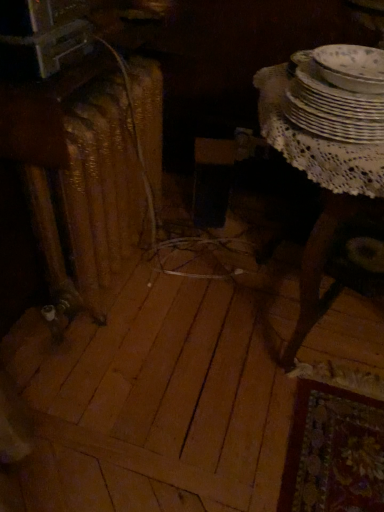
Question: Considering the relative positions of white porcelain plates at upper right, the first tableware viewed from the top, and white lace table at right in the image provided, is white porcelain plates at upper right, the first tableware viewed from the top, to the left of white lace table at right from the viewer's perspective?

Choices:
 (A) no
 (B) yes

Answer: (B)

Question: Can you confirm if white porcelain plates at upper right, the first tableware viewed from the top, is smaller than white lace table at right?

Choices:
 (A) no
 (B) yes

Answer: (B)

Question: Can you confirm if white porcelain plates at upper right, the first tableware viewed from the top, is thinner than white lace table at right?

Choices:
 (A) yes
 (B) no

Answer: (A)

Question: Is white porcelain plates at upper right, the first tableware viewed from the top, located outside white lace table at right?

Choices:
 (A) yes
 (B) no

Answer: (A)

Question: Is white porcelain plates at upper right, the first tableware viewed from the top, taller than white lace table at right?

Choices:
 (A) no
 (B) yes

Answer: (A)

Question: Is white porcelain plates at upper right, acting as the 2th tableware starting from the bottom, wider or thinner than rusty metal radiator at left?

Choices:
 (A) wide
 (B) thin

Answer: (B)

Question: Do you think white porcelain plates at upper right, the first tableware viewed from the top, is within rusty metal radiator at left, or outside of it?

Choices:
 (A) inside
 (B) outside

Answer: (B)

Question: Is white porcelain plates at upper right, acting as the 2th tableware starting from the bottom, bigger or smaller than rusty metal radiator at left?

Choices:
 (A) small
 (B) big

Answer: (A)

Question: Considering their positions, is white porcelain plates at upper right, the first tableware viewed from the top, located in front of or behind rusty metal radiator at left?

Choices:
 (A) front
 (B) behind

Answer: (A)

Question: Considering the relative positions of white porcelain plates at upper right, acting as the 2th tableware starting from the bottom, and porcelain plates at upper right, which ranks as the 2th tableware in top-to-bottom order, in the image provided, is white porcelain plates at upper right, acting as the 2th tableware starting from the bottom, to the left or to the right of porcelain plates at upper right, which ranks as the 2th tableware in top-to-bottom order,?

Choices:
 (A) right
 (B) left

Answer: (A)

Question: From the image's perspective, is white porcelain plates at upper right, the first tableware viewed from the top, located above or below porcelain plates at upper right, which ranks as the 2th tableware in top-to-bottom order?

Choices:
 (A) above
 (B) below

Answer: (A)

Question: Considering the positions of white porcelain plates at upper right, acting as the 2th tableware starting from the bottom, and porcelain plates at upper right, which ranks as the 2th tableware in top-to-bottom order, in the image, is white porcelain plates at upper right, acting as the 2th tableware starting from the bottom, taller or shorter than porcelain plates at upper right, which ranks as the 2th tableware in top-to-bottom order,?

Choices:
 (A) short
 (B) tall

Answer: (A)

Question: Looking at the image, does white porcelain plates at upper right, acting as the 2th tableware starting from the bottom, seem bigger or smaller compared to porcelain plates at upper right, the 1th tableware from the bottom?

Choices:
 (A) small
 (B) big

Answer: (A)

Question: Relative to white lace table at right, is white porcelain plates at upper right, acting as the 2th tableware starting from the bottom, in front or behind?

Choices:
 (A) front
 (B) behind

Answer: (B)

Question: Visually, is white porcelain plates at upper right, acting as the 2th tableware starting from the bottom, positioned to the left or to the right of white lace table at right?

Choices:
 (A) left
 (B) right

Answer: (A)